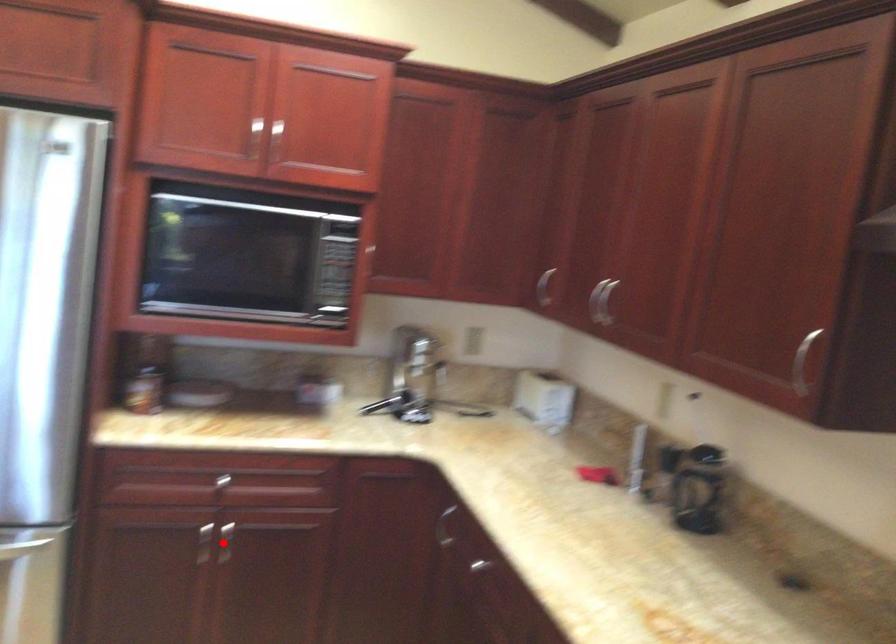
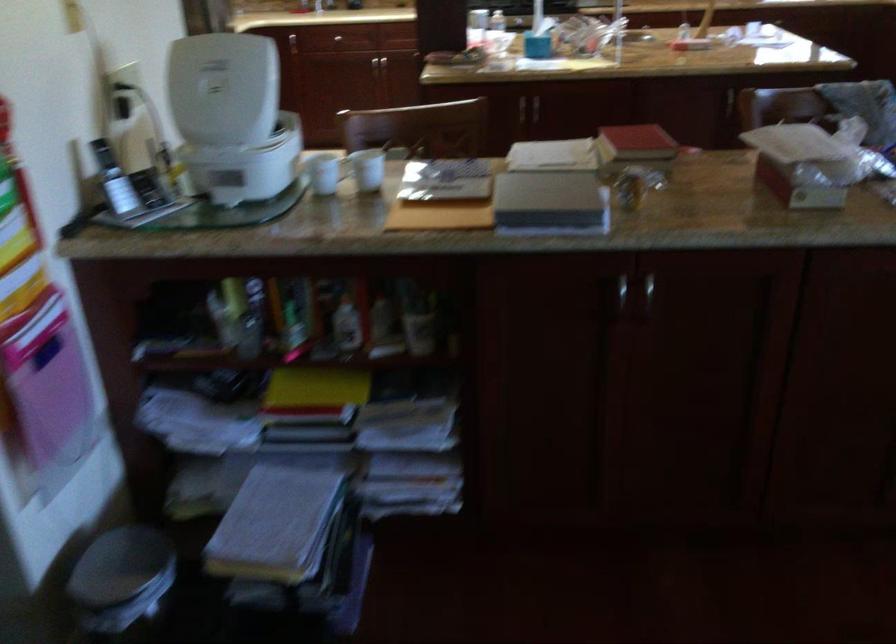
Question: I am providing you with two images of the same scene from different viewpoints. A red point is marked on the first image. At the location where the point appears in image 1, is it still visible in image 2?

Choices:
 (A) Yes
 (B) No

Answer: (B)